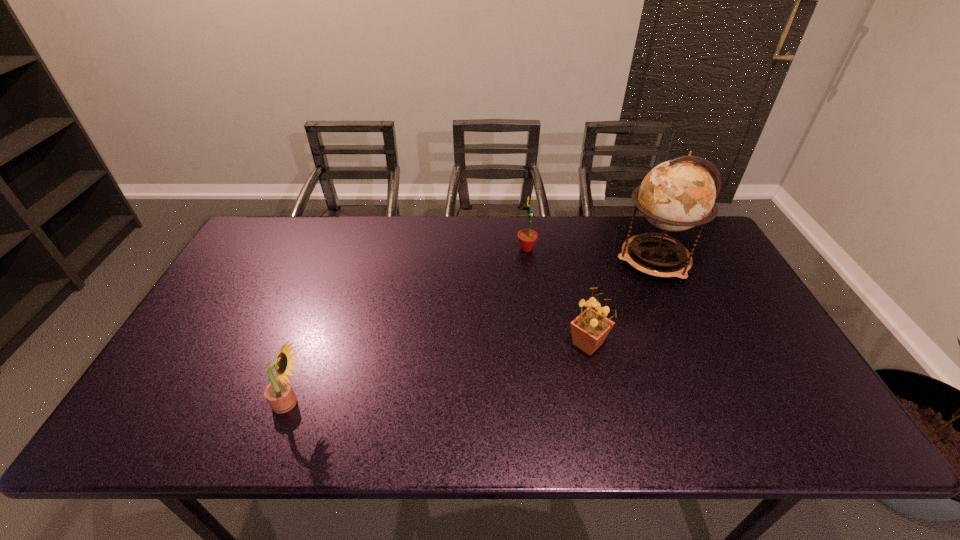
Image resolution: width=960 pixels, height=540 pixels. Identify the location of the tallest object. (676, 195).

Locate an element on the screen. globe is located at coordinates (676, 195).

Where is `the third object from right to left`? The image size is (960, 540). the third object from right to left is located at coordinates (527, 237).

Locate an element on the screen. The image size is (960, 540). the second sunflower from left to right is located at coordinates (527, 237).

I want to click on the second nearest object, so click(589, 330).

At what (x,y) coordinates should I click in order to perform the action: click on the third object from left to right. Please return your answer as a coordinate pair (x, y). The image size is (960, 540). Looking at the image, I should click on (589, 330).

I want to click on the leftmost sunflower, so click(279, 393).

Identify the location of the nearest object. (279, 393).

Locate an element on the screen. Image resolution: width=960 pixels, height=540 pixels. vacant space located at the center of the rightmost object is located at coordinates pos(552,261).

I want to click on vacant space situated at the center of the rightmost object, so click(x=498, y=261).